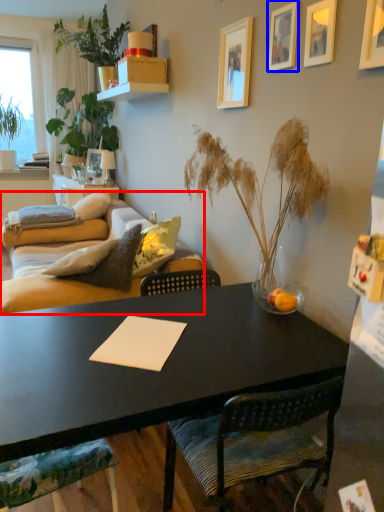
Question: Which point is further to the camera, studio couch (highlighted by a red box) or picture frame (highlighted by a blue box)?

Choices:
 (A) studio couch
 (B) picture frame

Answer: (A)